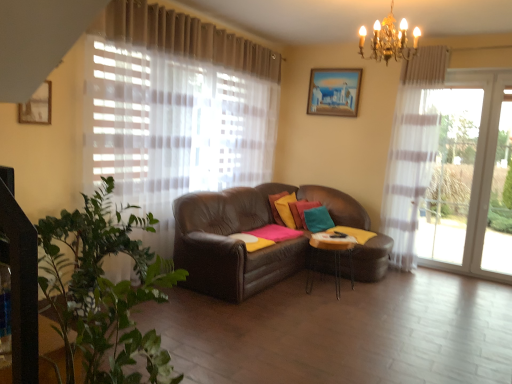
Question: From the image's perspective, is wooden painted picture frame at upper center, the first picture frame viewed from the top, on top of teal fabric pillow at center, arranged as the third pillow when viewed from the left?

Choices:
 (A) no
 (B) yes

Answer: (B)

Question: Is wooden painted picture frame at upper center, which is the second picture frame in left-to-right order, facing towards teal fabric pillow at center, which ranks as the 1th pillow in right-to-left order?

Choices:
 (A) yes
 (B) no

Answer: (B)

Question: Considering the relative sizes of wooden painted picture frame at upper center, which is the 2th picture frame from bottom to top, and teal fabric pillow at center, arranged as the third pillow when viewed from the left, in the image provided, is wooden painted picture frame at upper center, which is the 2th picture frame from bottom to top, thinner than teal fabric pillow at center, arranged as the third pillow when viewed from the left,?

Choices:
 (A) no
 (B) yes

Answer: (B)

Question: From a real-world perspective, is wooden painted picture frame at upper center, which is the 2th picture frame from bottom to top, physically below teal fabric pillow at center, arranged as the third pillow when viewed from the left?

Choices:
 (A) yes
 (B) no

Answer: (B)

Question: From a real-world perspective, is wooden painted picture frame at upper center, the first picture frame viewed from the right, physically above teal fabric pillow at center, arranged as the third pillow when viewed from the left?

Choices:
 (A) yes
 (B) no

Answer: (A)

Question: Is wooden painted picture frame at upper center, the first picture frame viewed from the right, bigger than teal fabric pillow at center, which ranks as the 1th pillow in right-to-left order?

Choices:
 (A) yes
 (B) no

Answer: (B)

Question: Is velvet yellow pillow at center, the third pillow positioned from the right, outside of metallic silver table at center?

Choices:
 (A) yes
 (B) no

Answer: (A)

Question: From the image's perspective, is velvet yellow pillow at center, the third pillow positioned from the right, below metallic silver table at center?

Choices:
 (A) no
 (B) yes

Answer: (A)

Question: Can you confirm if velvet yellow pillow at center, the third pillow positioned from the right, is taller than metallic silver table at center?

Choices:
 (A) yes
 (B) no

Answer: (B)

Question: Considering the relative sizes of velvet yellow pillow at center, the third pillow positioned from the right, and metallic silver table at center in the image provided, is velvet yellow pillow at center, the third pillow positioned from the right, thinner than metallic silver table at center?

Choices:
 (A) no
 (B) yes

Answer: (B)

Question: Is velvet yellow pillow at center, marked as the first pillow in a left-to-right arrangement, oriented away from metallic silver table at center?

Choices:
 (A) yes
 (B) no

Answer: (B)

Question: From a real-world perspective, is velvet yellow pillow at center, marked as the first pillow in a left-to-right arrangement, physically above metallic silver table at center?

Choices:
 (A) yes
 (B) no

Answer: (A)

Question: From the image's perspective, is wooden picture frame at upper left, the 2th picture frame from the back, over wooden painted picture frame at upper center, which is the 2th picture frame from bottom to top?

Choices:
 (A) no
 (B) yes

Answer: (A)